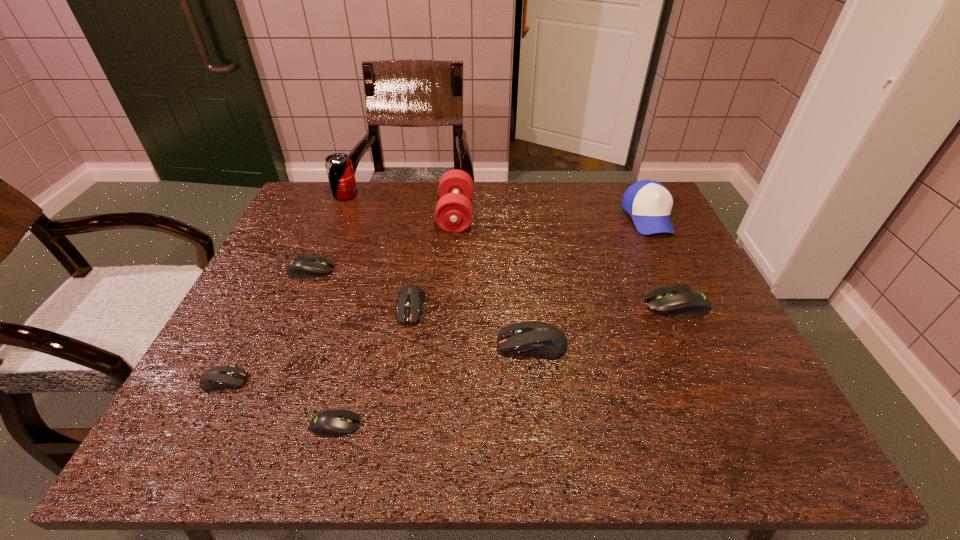
Image resolution: width=960 pixels, height=540 pixels. What are the coordinates of `the leftmost gray computer mouse` in the screenshot? It's located at (306, 266).

The height and width of the screenshot is (540, 960). Find the location of `the nearest dark computer equipment`. the nearest dark computer equipment is located at coordinates (223, 377).

Where is `the second nearest computer mouse`? The height and width of the screenshot is (540, 960). the second nearest computer mouse is located at coordinates (223, 377).

Identify the location of the smallest gray computer mouse. The width and height of the screenshot is (960, 540). (332, 423).

Where is `the second gray computer mouse from right to left`? Image resolution: width=960 pixels, height=540 pixels. the second gray computer mouse from right to left is located at coordinates (332, 423).

This screenshot has height=540, width=960. Identify the location of vacant space located on the right of the soda can. (468, 195).

The width and height of the screenshot is (960, 540). I want to click on vacant space located on the front of the dumbbell, so click(x=448, y=322).

In order to click on free region located on the front-facing side of the white baseball cap in this screenshot , I will do `click(674, 270)`.

Find the location of a particular element. vacant space located 0.240m on the button of the biggest dark computer equipment is located at coordinates (385, 345).

At what (x,y) coordinates should I click in order to perform the action: click on free point located 0.140m on the button of the biggest dark computer equipment. Please return your answer as a coordinate pair (x, y). The image size is (960, 540). Looking at the image, I should click on (432, 345).